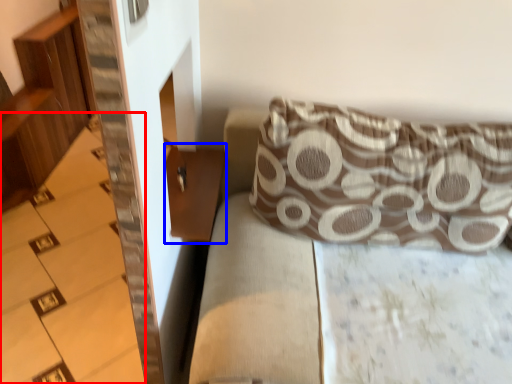
Question: Among these objects, which one is nearest to the camera, stairwell (highlighted by a red box) or table (highlighted by a blue box)?

Choices:
 (A) stairwell
 (B) table

Answer: (B)